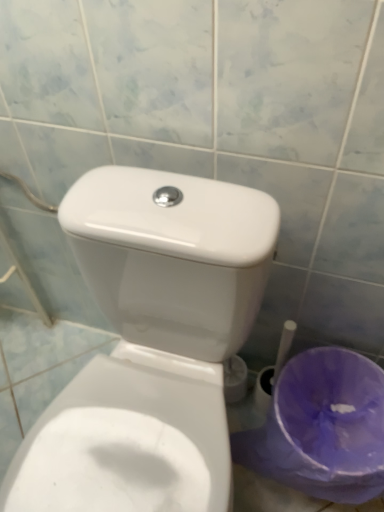
Question: Can you confirm if white glossy toilet at center is thinner than purple plastic potty at lower right?

Choices:
 (A) yes
 (B) no

Answer: (B)

Question: Could you tell me if white glossy toilet at center is facing purple plastic potty at lower right?

Choices:
 (A) no
 (B) yes

Answer: (A)

Question: Is white glossy toilet at center wider than purple plastic potty at lower right?

Choices:
 (A) no
 (B) yes

Answer: (B)

Question: Is white glossy toilet at center bigger than purple plastic potty at lower right?

Choices:
 (A) yes
 (B) no

Answer: (A)

Question: From a real-world perspective, is white glossy toilet at center beneath purple plastic potty at lower right?

Choices:
 (A) yes
 (B) no

Answer: (B)

Question: Does white glossy toilet at center have a greater height compared to purple plastic potty at lower right?

Choices:
 (A) no
 (B) yes

Answer: (B)

Question: From a real-world perspective, is purple plastic potty at lower right positioned over white glossy toilet at center based on gravity?

Choices:
 (A) no
 (B) yes

Answer: (A)

Question: Is purple plastic potty at lower right thinner than white glossy toilet at center?

Choices:
 (A) yes
 (B) no

Answer: (A)

Question: Can you confirm if purple plastic potty at lower right is smaller than white glossy toilet at center?

Choices:
 (A) no
 (B) yes

Answer: (B)

Question: Is purple plastic potty at lower right bigger than white glossy toilet at center?

Choices:
 (A) yes
 (B) no

Answer: (B)

Question: Can you confirm if purple plastic potty at lower right is positioned to the left of white glossy toilet at center?

Choices:
 (A) no
 (B) yes

Answer: (A)

Question: Are purple plastic potty at lower right and white glossy toilet at center making contact?

Choices:
 (A) yes
 (B) no

Answer: (B)

Question: Is purple plastic potty at lower right situated inside white glossy toilet at center or outside?

Choices:
 (A) outside
 (B) inside

Answer: (A)